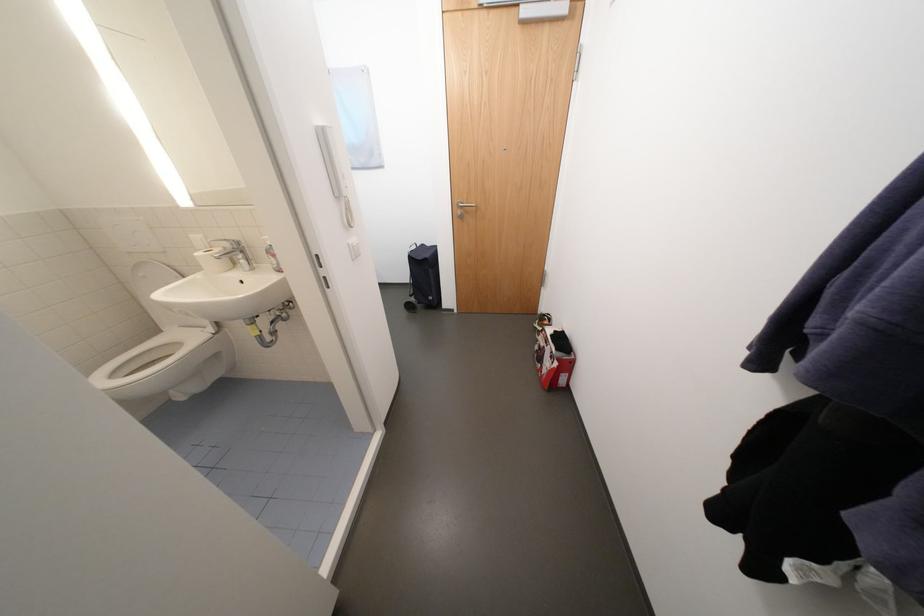
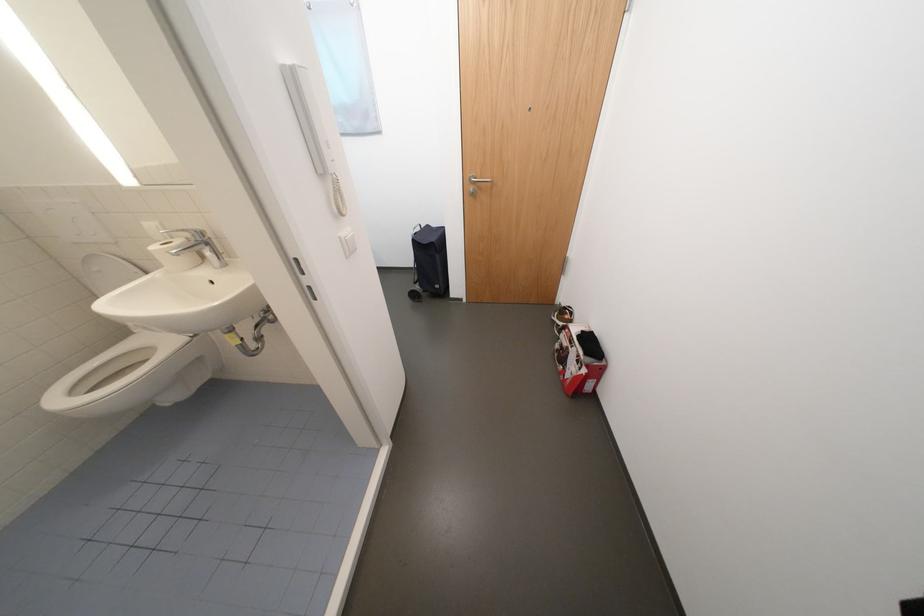
Find the pixel in the second image that matches pixel 325 128 in the first image.

(292, 66)